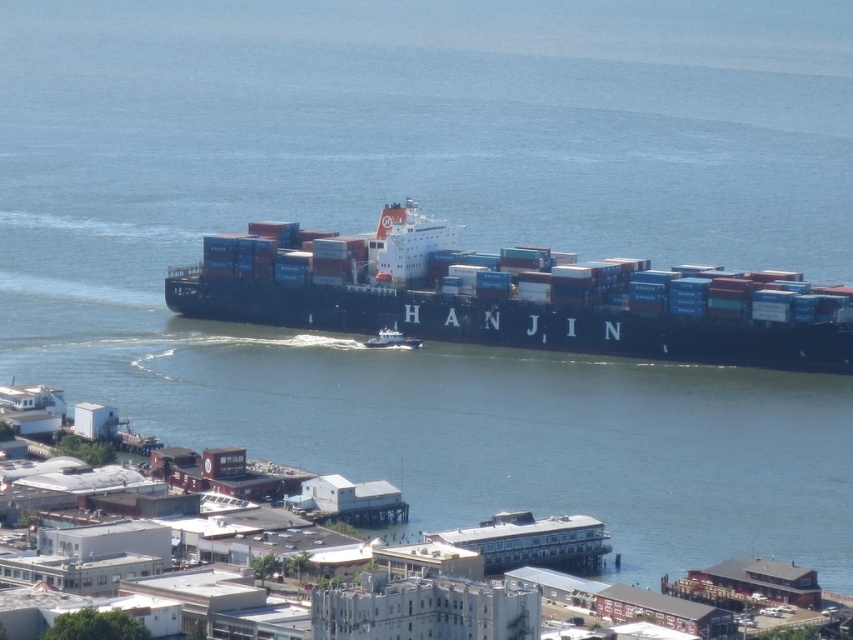
You are a photographer positioned on the shore, aiming to capture both the blue matte container ship at center and the white glossy boat at center in a single shot. Based on their positions, which vessel should you adjust your camera to focus on first to ensure both are in frame?

The blue matte container ship at center is to the right of the white glossy boat at center, so you should focus on the white glossy boat at center first to ensure both are within the frame.

You are a crane operator at the port, and you need to load a new container onto the highest point of the blue matte container ship at center. Considering the white glossy boat at center nearby, will the new container obstruct the boat? Please explain your reasoning.

The blue matte container ship at center is taller than the white glossy boat at center. Adding a new container to the highest point of the blue matte container ship at center would make it even taller, but since the white glossy boat at center is already shorter, the container would not obstruct the boat.

You are a maritime navigation officer trying to determine the position of the blue matte container ship at center relative to a reference point at coordinates 0.5, 0.5. Is the ship positioned to the left or right of this reference point?

The blue matte container ship at center is located at point (511, 296), which means it is positioned to the left of the reference point at (426, 320) since the x coordinate is less than 0.5.